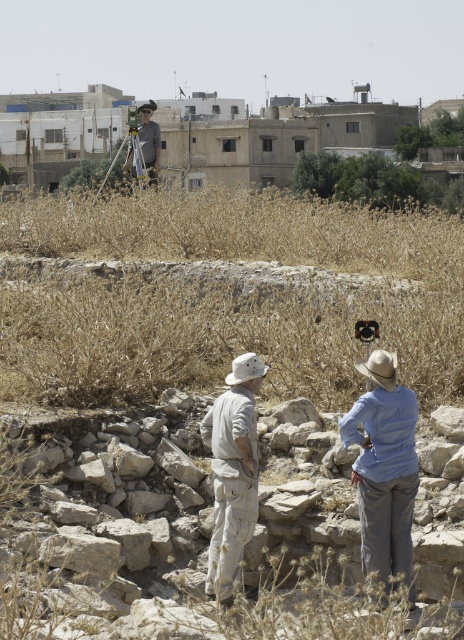
Question: Does blue cotton shirt at lower right come behind matte black tripod at upper center?

Choices:
 (A) no
 (B) yes

Answer: (A)

Question: Which object appears farthest from the camera in this image?

Choices:
 (A) blue cotton shirt at lower right
 (B) matte black tripod at upper center

Answer: (B)

Question: Does blue cotton shirt at lower right have a lesser width compared to matte black tripod at upper center?

Choices:
 (A) yes
 (B) no

Answer: (A)

Question: Which of the following is the closest to the observer?

Choices:
 (A) matte black tripod at upper center
 (B) rusty stone rubble at center

Answer: (B)

Question: Which point is farther to the camera?

Choices:
 (A) tan canvas hat at center
 (B) metallic tripod at upper center
 (C) matte black tripod at upper center
 (D) rusty stone rubble at center

Answer: (C)

Question: Does tan canvas hat at center have a larger size compared to matte black tripod at upper center?

Choices:
 (A) yes
 (B) no

Answer: (B)